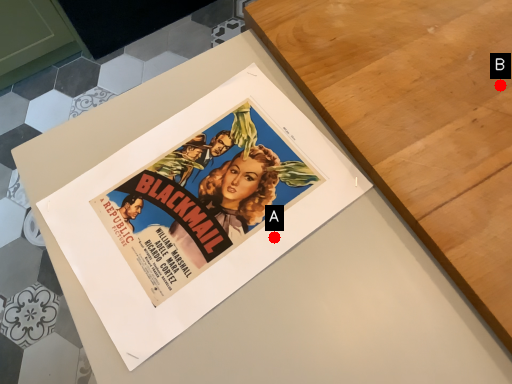
Question: Two points are circled on the image, labeled by A and B beside each circle. Which of the following is the farthest from the observer?

Choices:
 (A) A is further
 (B) B is further

Answer: (B)